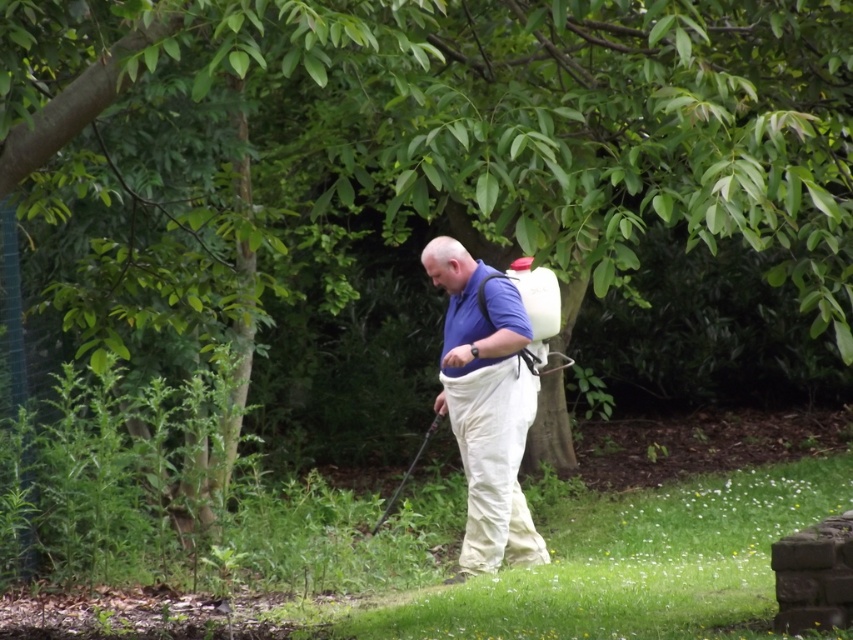
You are a photographer trying to capture the man in the blue fabric shirt at center without any foreground distractions. Since the green grass at lower center is blocking part of him, can you move to the side to get a clearer shot?

The blue fabric shirt at center is behind the green grass at lower center, so moving to the side might help you avoid the grass blocking the view of the man.

You are a gardener standing in the park. You need to place a small potted plant between the green grass at lower center and the blue fabric shirt at center. Which object should the potted plant be closer to based on their widths?

The green grass at lower center has a lesser width compared to the blue fabric shirt at center, so the potted plant should be placed closer to the blue fabric shirt at center to ensure there is enough space.

You are standing at the center of the garden and want to place a small potted plant exactly where the green grass at lower center is located. According to the coordinates given, where should you place the potted plant?

You should place the potted plant at the coordinates point (636, 564) where the green grass at lower center is located.